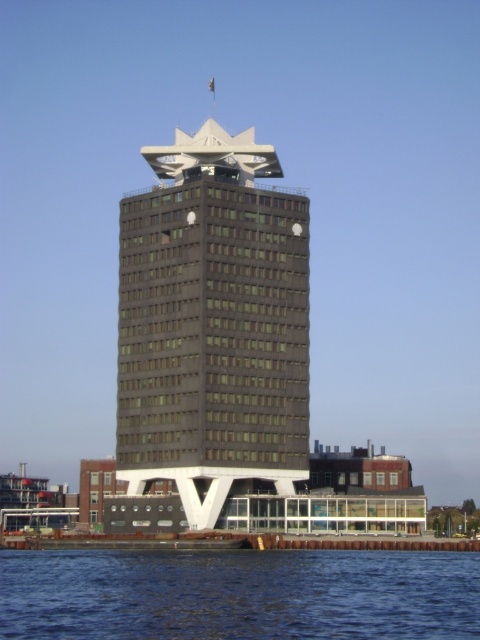
Does dark gray concrete tower at center appear on the right side of blue water at lower left?

Incorrect, dark gray concrete tower at center is not on the right side of blue water at lower left.

The height and width of the screenshot is (640, 480). What are the coordinates of `dark gray concrete tower at center` in the screenshot? It's located at (213, 324).